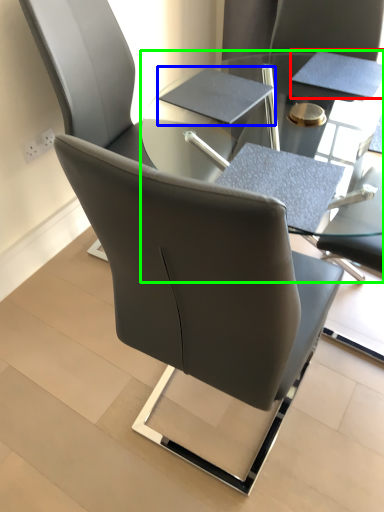
Question: Estimate the real-world distances between objects in this image. Which object is closer to notepad (highlighted by a red box), notebook (highlighted by a blue box) or table (highlighted by a green box)?

Choices:
 (A) notebook
 (B) table

Answer: (B)